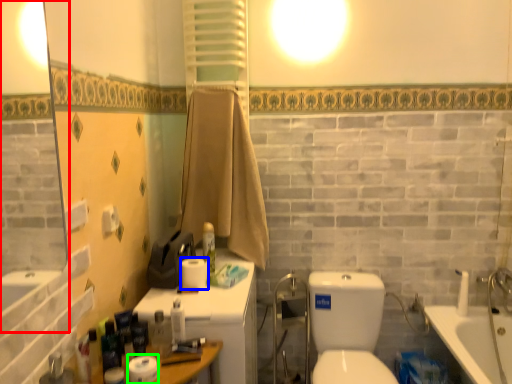
Question: Which is farther away from mirror (highlighted by a red box)? toilet paper (highlighted by a blue box) or toilet paper (highlighted by a green box)?

Choices:
 (A) toilet paper
 (B) toilet paper

Answer: (B)